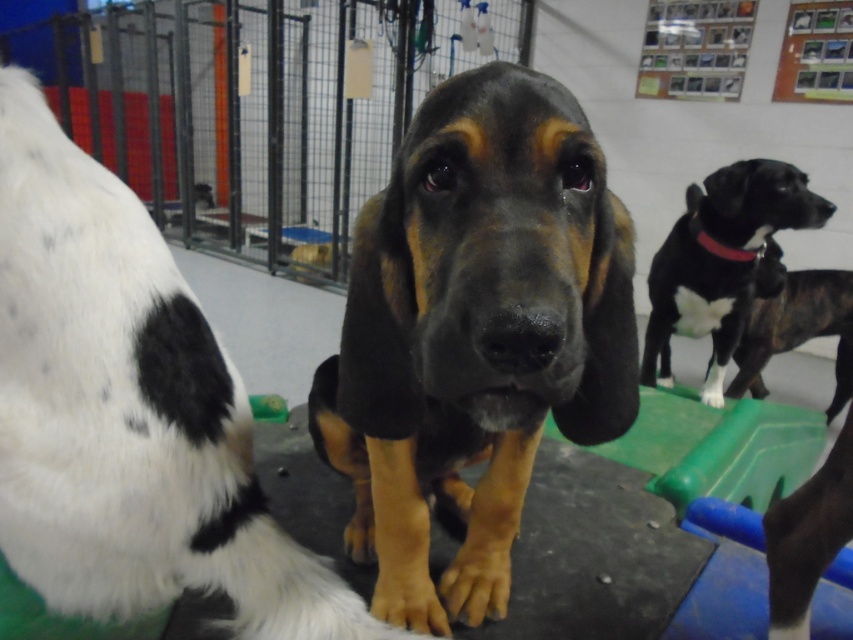
Question: Which of these objects is positioned farthest from the black smooth dog at upper right?

Choices:
 (A) black smooth dog at center
 (B) black smooth fur at center
 (C) brindle fur dog at right

Answer: (B)

Question: Which point is closer to the camera taking this photo?

Choices:
 (A) (828, 332)
 (B) (428, 196)
 (C) (740, 296)
 (D) (115, 403)

Answer: (B)

Question: Where is black smooth fur at center located in relation to brindle fur dog at right in the image?

Choices:
 (A) left
 (B) right

Answer: (A)

Question: Can you confirm if black smooth fur at center is positioned above brindle fur dog at right?

Choices:
 (A) yes
 (B) no

Answer: (B)

Question: Which of the following is the closest to the observer?

Choices:
 (A) black smooth fur at center
 (B) black smooth dog at center
 (C) black smooth dog at upper right
 (D) brindle fur dog at right

Answer: (B)

Question: Is black smooth dog at upper right positioned at the back of brindle fur dog at right?

Choices:
 (A) no
 (B) yes

Answer: (A)